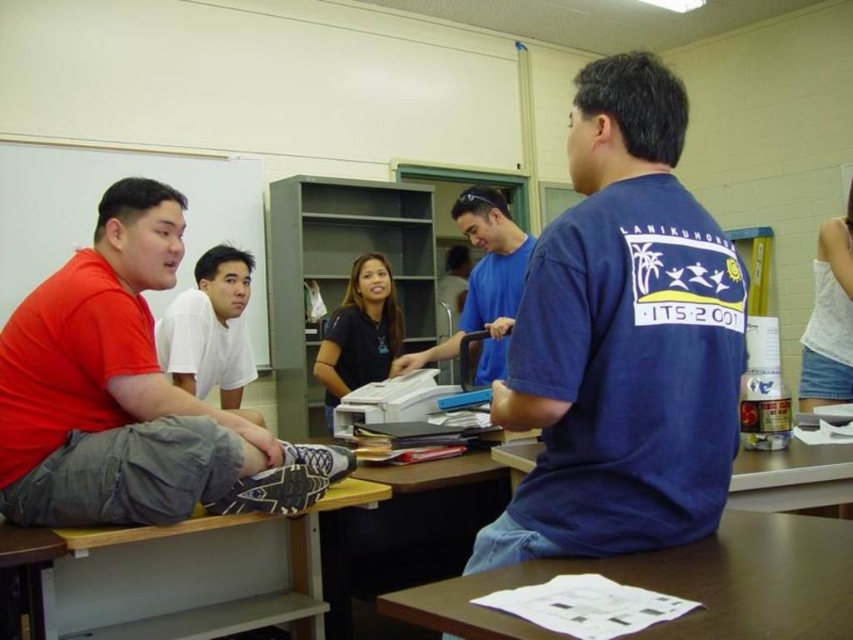
The height and width of the screenshot is (640, 853). I want to click on brown wooden table at center, so click(x=792, y=477).

Who is lower down, brown wooden table at center or matte black shirt at center?

brown wooden table at center is lower down.

Between point (838, 492) and point (381, 256), which one is positioned behind?

The point (381, 256) is more distant.

Find the location of `brown wooden table at center`. brown wooden table at center is located at coordinates (792, 477).

Does wooden table at center have a greater width compared to white matte shirt at center?

Yes.

In the scene shown: Is wooden table at center to the right of white matte shirt at center from the viewer's perspective?

Correct, you'll find wooden table at center to the right of white matte shirt at center.

The width and height of the screenshot is (853, 640). What do you see at coordinates (682, 584) in the screenshot?
I see `wooden table at center` at bounding box center [682, 584].

Where is `wooden table at center`? wooden table at center is located at coordinates (682, 584).

Can you confirm if wooden table at lower left is shorter than matte black shirt at center?

Indeed, wooden table at lower left has a lesser height compared to matte black shirt at center.

Does point (299, 634) come farther from viewer compared to point (318, 371)?

No, it is not.

Does point (254, 579) come closer to viewer compared to point (349, 348)?

Yes.

What are the coordinates of `wooden table at lower left` in the screenshot? It's located at point(198,573).